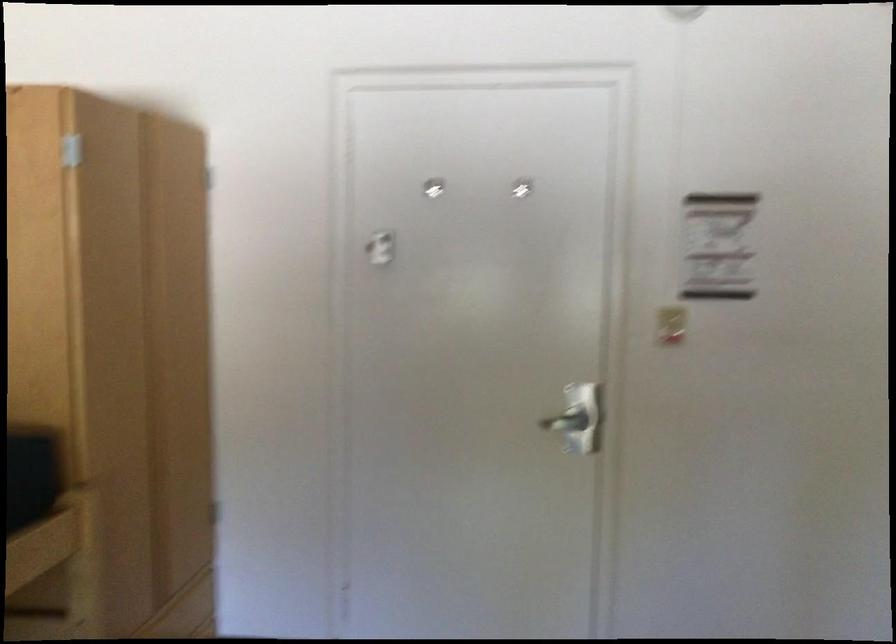
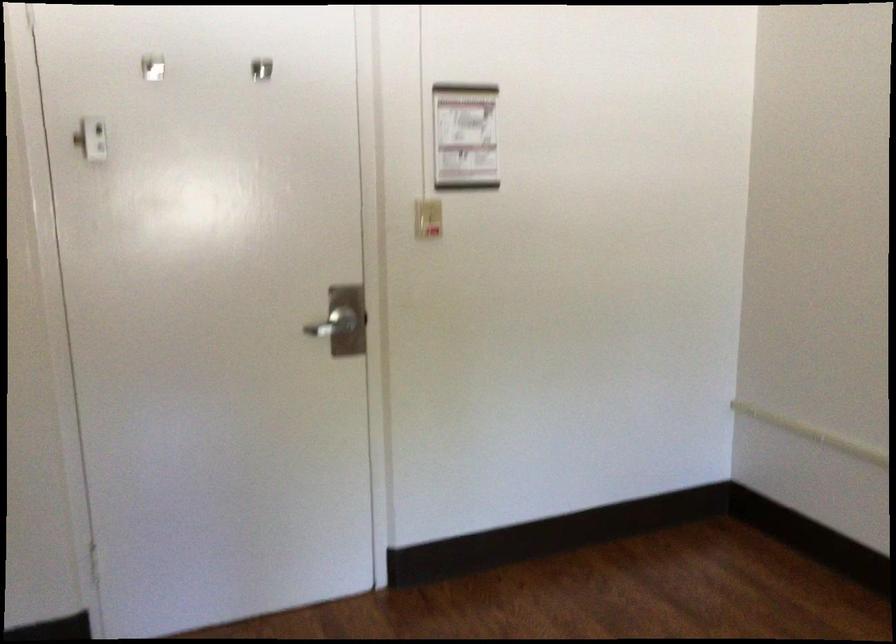
Which direction would the cameraman need to move to produce the second image?

The movement direction of the cameraman is left, forward.